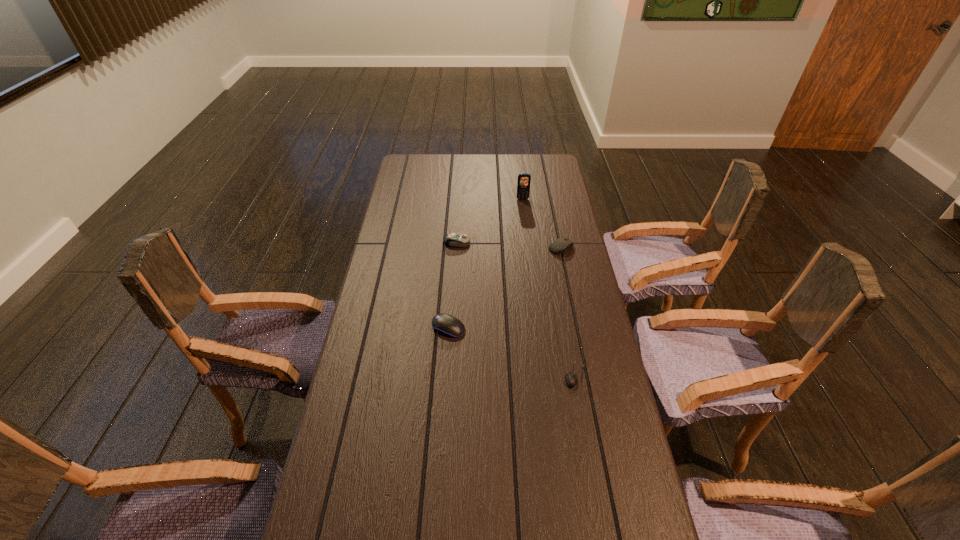
Find the location of `the third object from left to right`. the third object from left to right is located at coordinates (523, 184).

Where is `the farthest object`? The image size is (960, 540). the farthest object is located at coordinates (523, 184).

At what (x,y) coordinates should I click in order to perform the action: click on the third farthest mouse. Please return your answer as a coordinate pair (x, y). Looking at the image, I should click on (445, 324).

Identify the location of the nearest mouse. (572, 379).

At what (x,y) coordinates should I click in order to perform the action: click on the shortest mouse. Please return your answer as a coordinate pair (x, y). The width and height of the screenshot is (960, 540). Looking at the image, I should click on (572, 379).

This screenshot has width=960, height=540. What are the coordinates of `vacant area located 0.290m on the screen of the farthest object` in the screenshot? It's located at (528, 242).

Identify the location of vacant space located on the right of the second nearest object. (575, 328).

I want to click on vacant space located 0.310m on the left of the nearest object, so click(x=458, y=376).

In the image, there is a desktop. At what (x,y) coordinates should I click in order to perform the action: click on vacant space at the left edge. Please return your answer as a coordinate pair (x, y). Looking at the image, I should click on [x=374, y=388].

This screenshot has width=960, height=540. Identify the location of vacant space at the right edge. (569, 208).